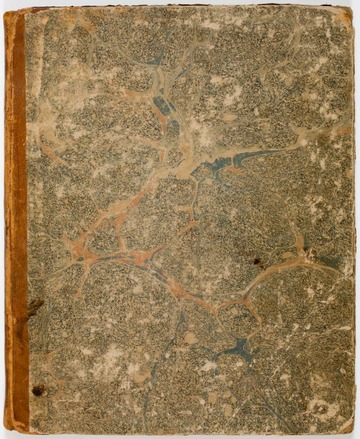
Image resolution: width=360 pixels, height=439 pixels. Find the location of `frrayed corners of book cover`. frrayed corners of book cover is located at coordinates (346, 10), (352, 429).